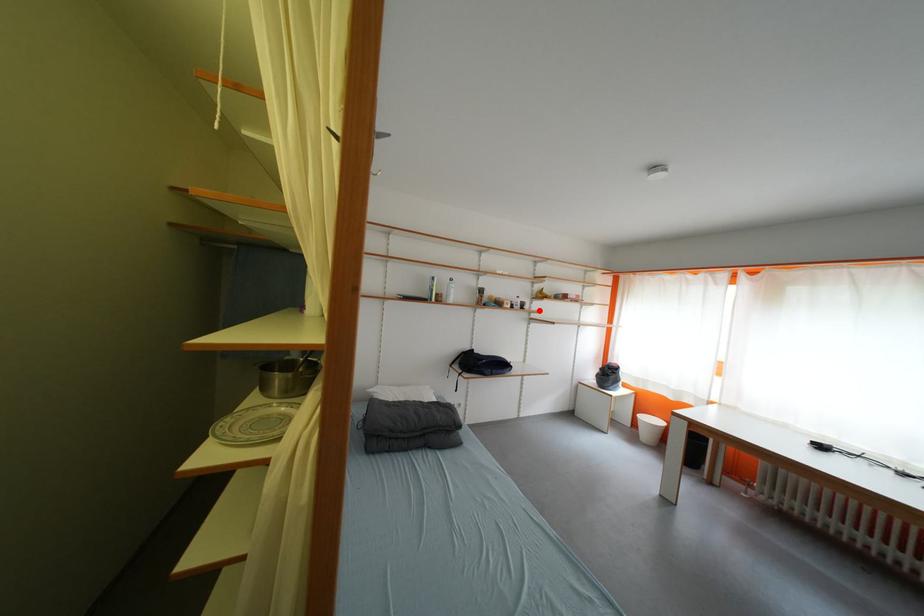
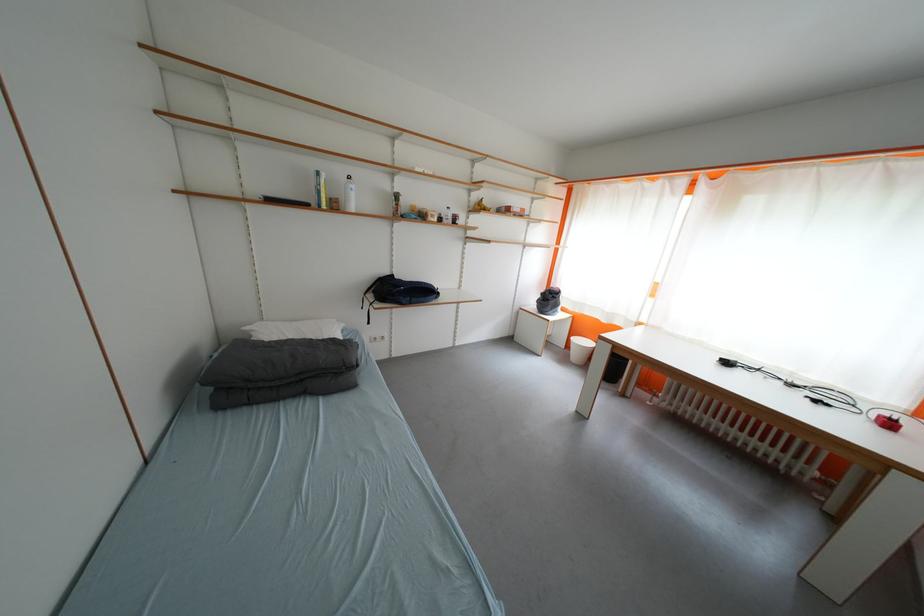
Question: A red point is marked in image1. In image2, is the corresponding 3D point closer to the camera or farther? Reply with the corresponding letter.

Choices:
 (A) The corresponding 3D point is closer.
 (B) The corresponding 3D point is farther.

Answer: (A)